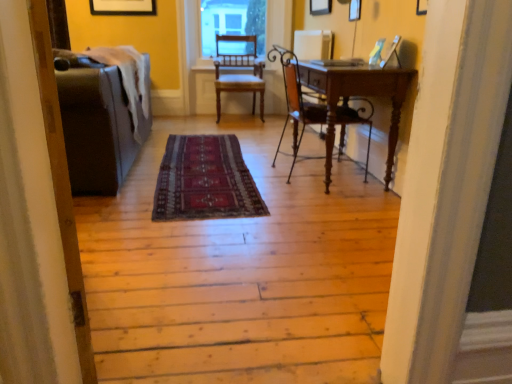
Question: Is matte black couch at left further to camera compared to clear glass window screen at upper center?

Choices:
 (A) no
 (B) yes

Answer: (A)

Question: From the image's perspective, is matte black couch at left located above clear glass window screen at upper center?

Choices:
 (A) yes
 (B) no

Answer: (B)

Question: Is matte black couch at left surrounding clear glass window screen at upper center?

Choices:
 (A) yes
 (B) no

Answer: (B)

Question: Does matte black couch at left appear on the right side of clear glass window screen at upper center?

Choices:
 (A) no
 (B) yes

Answer: (A)

Question: Is matte black couch at left aimed at clear glass window screen at upper center?

Choices:
 (A) no
 (B) yes

Answer: (A)

Question: From a real-world perspective, is matte black couch at left positioned under clear glass window screen at upper center based on gravity?

Choices:
 (A) yes
 (B) no

Answer: (A)

Question: Is matte gray couch at left positioned before wooden chair at center, the 1th chair in the bottom-to-top sequence?

Choices:
 (A) yes
 (B) no

Answer: (A)

Question: Is matte gray couch at left aimed at wooden chair at center, the second chair positioned from the left?

Choices:
 (A) yes
 (B) no

Answer: (B)

Question: From a real-world perspective, is matte gray couch at left on top of wooden chair at center, which is counted as the first chair, starting from the front?

Choices:
 (A) yes
 (B) no

Answer: (B)

Question: Can you confirm if matte gray couch at left is positioned to the left of wooden chair at center, which is counted as the first chair, starting from the front?

Choices:
 (A) no
 (B) yes

Answer: (B)

Question: From the image's perspective, is matte gray couch at left beneath wooden chair at center, which ranks as the 1th chair in right-to-left order?

Choices:
 (A) yes
 (B) no

Answer: (B)

Question: Is matte gray couch at left bigger than wooden chair at center, which ranks as the 1th chair in right-to-left order?

Choices:
 (A) yes
 (B) no

Answer: (A)

Question: Is matte gray couch at left smaller than wooden chair at center, arranged as the second chair when viewed from the front?

Choices:
 (A) no
 (B) yes

Answer: (A)